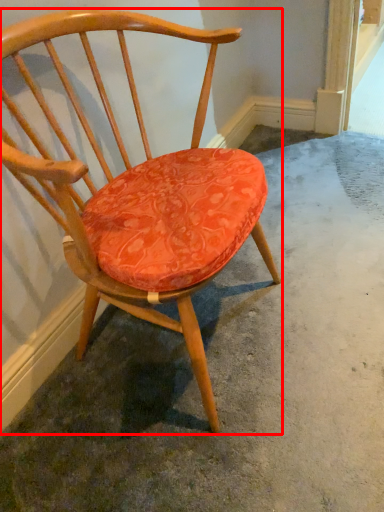
Question: Considering the relative positions of chair (annotated by the red box) and concrete in the image provided, where is chair (annotated by the red box) located with respect to the staircase?

Choices:
 (A) right
 (B) left

Answer: (B)